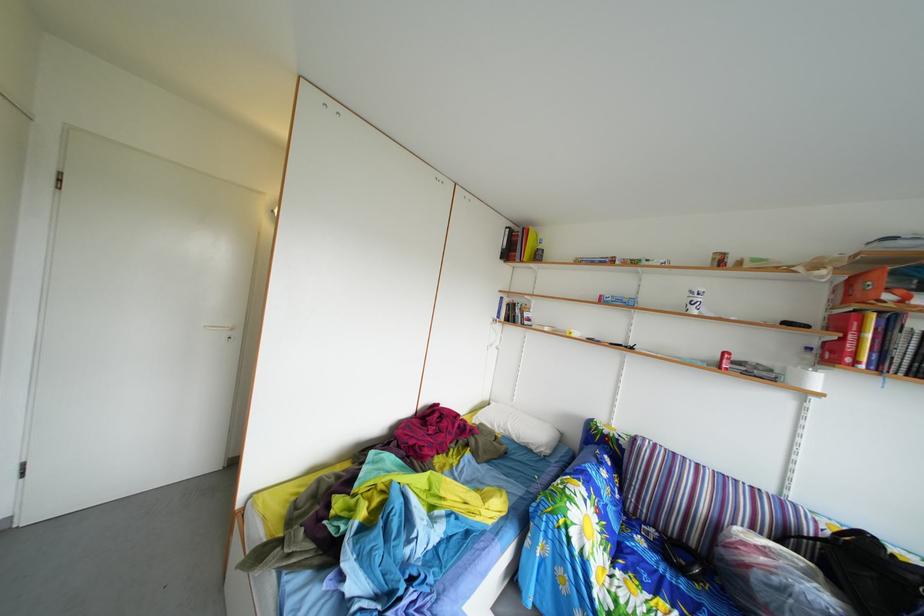
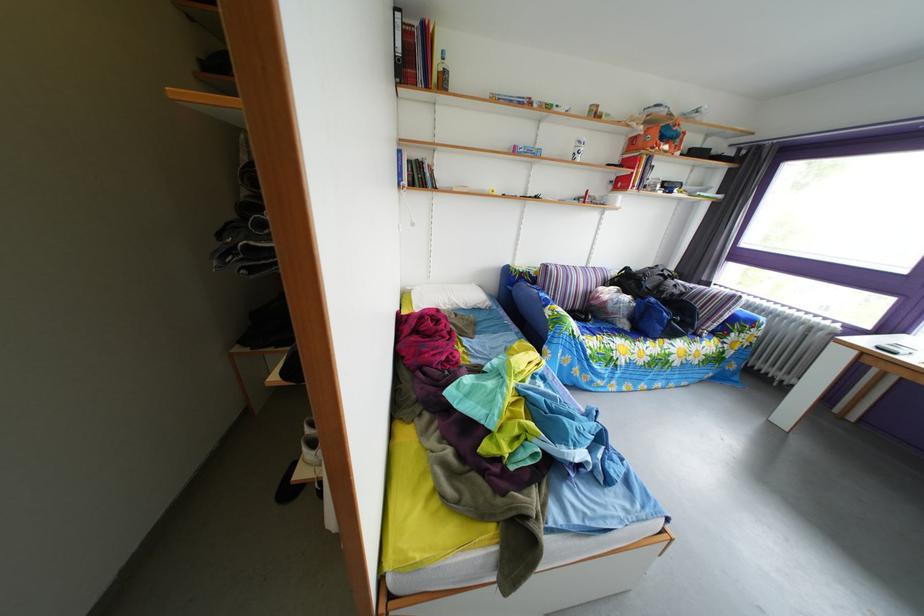
In the second image, find the point that corresponds to [609,453] in the first image.

(529, 289)